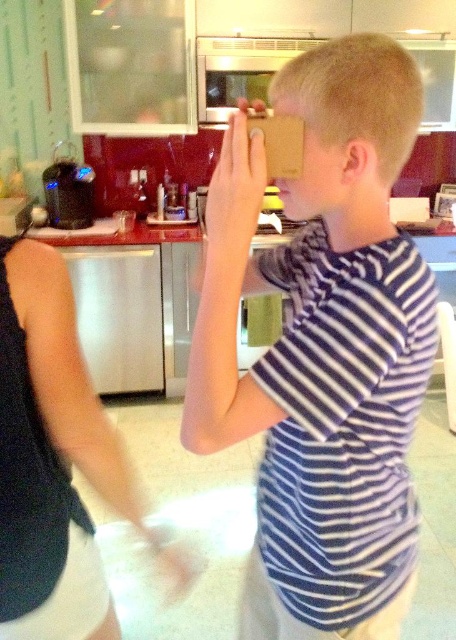
Question: Which of the following is the closest to the observer?

Choices:
 (A) white striped shirt at center
 (B) white fabric shirt at left

Answer: (A)

Question: Which of the following is the farthest from the observer?

Choices:
 (A) (373, 280)
 (B) (36, 582)

Answer: (B)

Question: Which object is closer to the camera taking this photo?

Choices:
 (A) white fabric shirt at left
 (B) white striped shirt at center

Answer: (B)

Question: Is white striped shirt at center below white fabric shirt at left?

Choices:
 (A) yes
 (B) no

Answer: (B)

Question: Can you confirm if white striped shirt at center is smaller than white fabric shirt at left?

Choices:
 (A) no
 (B) yes

Answer: (A)

Question: Is white striped shirt at center closer to the viewer compared to white fabric shirt at left?

Choices:
 (A) yes
 (B) no

Answer: (A)